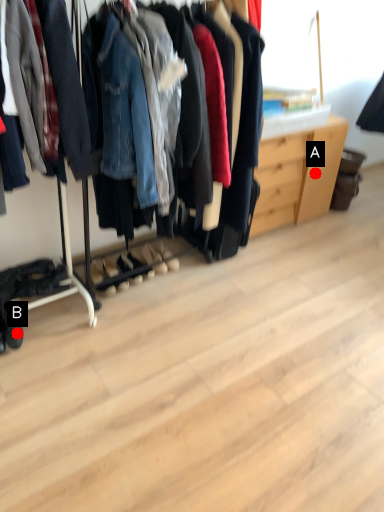
Question: Two points are circled on the image, labeled by A and B beside each circle. Which point is closer to the camera?

Choices:
 (A) A is closer
 (B) B is closer

Answer: (B)